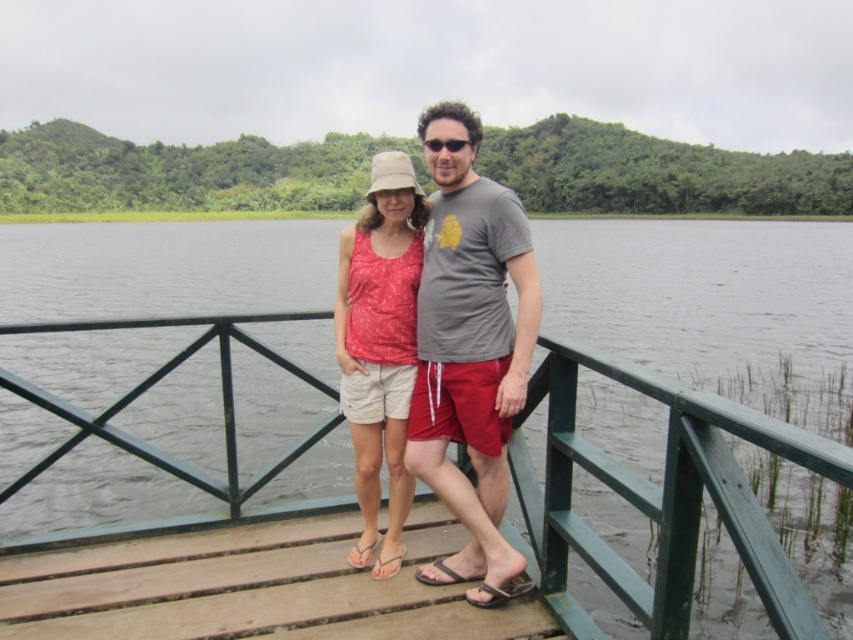
How far apart are matte gray t-shirt at center and matte pink tank top at center?

matte gray t-shirt at center is 27.57 inches from matte pink tank top at center.

Is matte gray t-shirt at center to the right of matte pink tank top at center from the viewer's perspective?

Yes, matte gray t-shirt at center is to the right of matte pink tank top at center.

What do you see at coordinates (469, 352) in the screenshot?
I see `matte gray t-shirt at center` at bounding box center [469, 352].

You are a GUI agent. You are given a task and a screenshot of the screen. Output one action in this format:
    pyautogui.click(x=<x>, y=<y>)
    Task: Click on the matte gray t-shirt at center
    This screenshot has width=853, height=640.
    Given the screenshot: What is the action you would take?
    pyautogui.click(x=469, y=352)

Is green painted wood at center to the left of matte pink tank top at center from the viewer's perspective?

Incorrect, green painted wood at center is not on the left side of matte pink tank top at center.

Can you confirm if green painted wood at center is thinner than matte pink tank top at center?

Yes, green painted wood at center is thinner than matte pink tank top at center.

Is point (554, 547) farther from camera compared to point (387, 180)?

No.

Find the location of `green painted wood at center`. green painted wood at center is located at coordinates (660, 499).

Between wooden dock at center and matte gray t-shirt at center, which one has more height?

With more height is matte gray t-shirt at center.

The height and width of the screenshot is (640, 853). What do you see at coordinates (251, 588) in the screenshot?
I see `wooden dock at center` at bounding box center [251, 588].

I want to click on wooden dock at center, so click(251, 588).